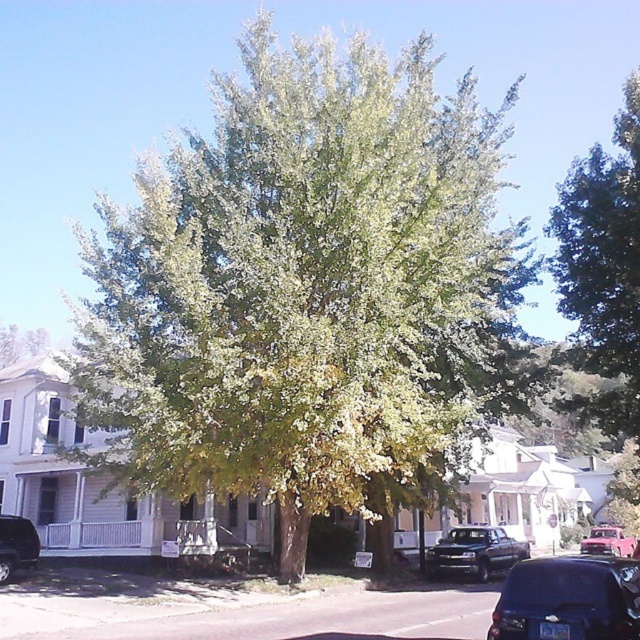
Question: Is green leafy tree at center closer to the viewer compared to metallic gray truck at center?

Choices:
 (A) no
 (B) yes

Answer: (B)

Question: Which of the following is the farthest from the observer?

Choices:
 (A) (433, 570)
 (B) (16, 548)

Answer: (A)

Question: Which of these objects is positioned farthest from the green leafy tree at center?

Choices:
 (A) shiny black car at lower right
 (B) green leafy tree at upper right

Answer: (A)

Question: Is shiny black car at lower right wider than pink matte car at lower right?

Choices:
 (A) yes
 (B) no

Answer: (B)

Question: Based on their relative distances, which object is nearer to the green leafy tree at center?

Choices:
 (A) pink matte car at lower right
 (B) shiny black car at lower right

Answer: (B)

Question: Can you confirm if green leafy tree at upper right is positioned below black glossy car at left?

Choices:
 (A) yes
 (B) no

Answer: (B)